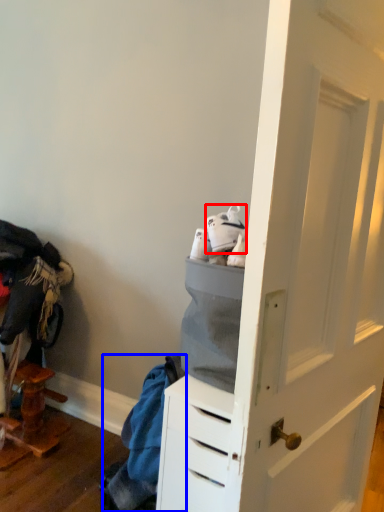
Question: Which object is closer to the camera taking this photo, footwear (highlighted by a red box) or clothing (highlighted by a blue box)?

Choices:
 (A) footwear
 (B) clothing

Answer: (A)